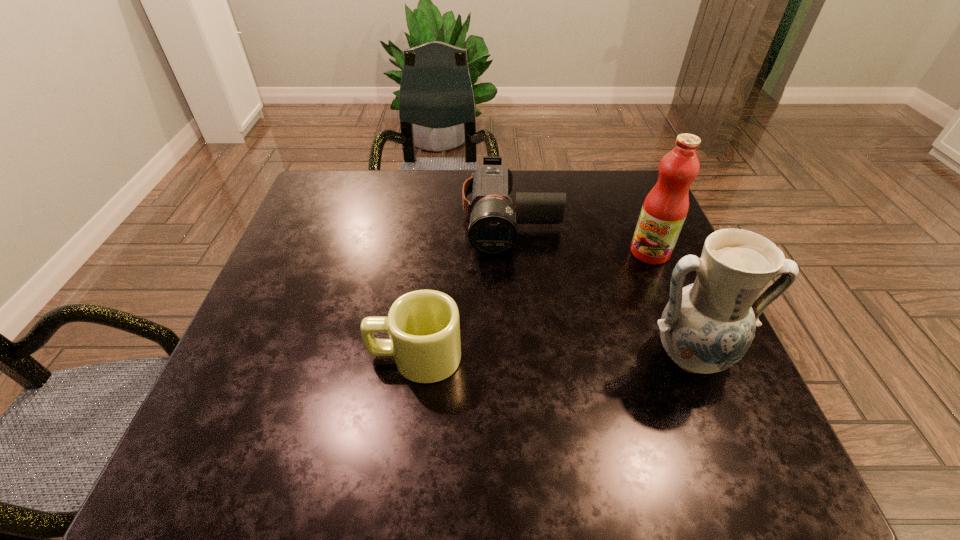
The image size is (960, 540). In order to click on vacant spot on the desktop that is between the mug and the pottery and is positioned on the front label of the fruit juice in this screenshot , I will do `click(514, 356)`.

Locate an element on the screen. free space on the desktop that is between the mug and the pottery and is positioned on the lens of the camcorder is located at coordinates (514, 356).